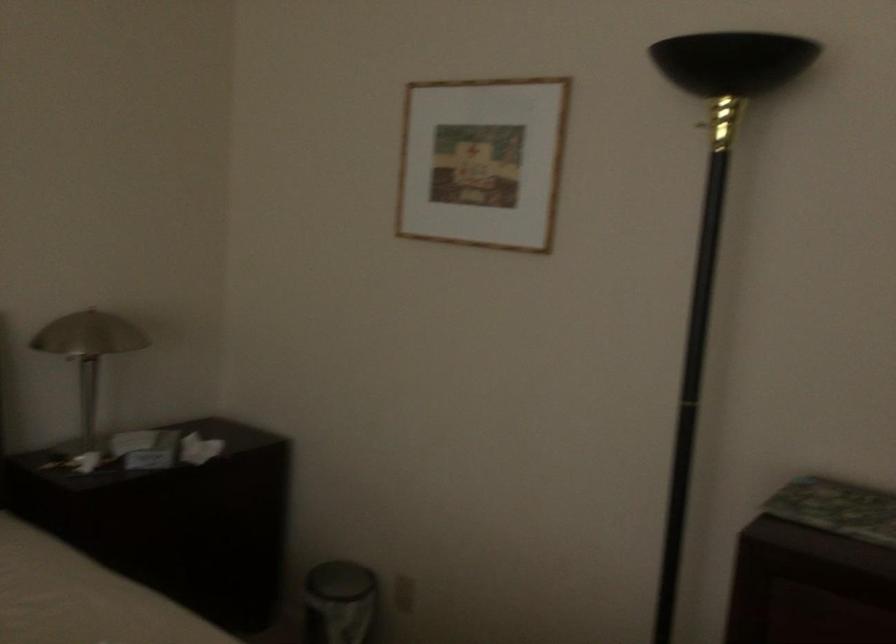
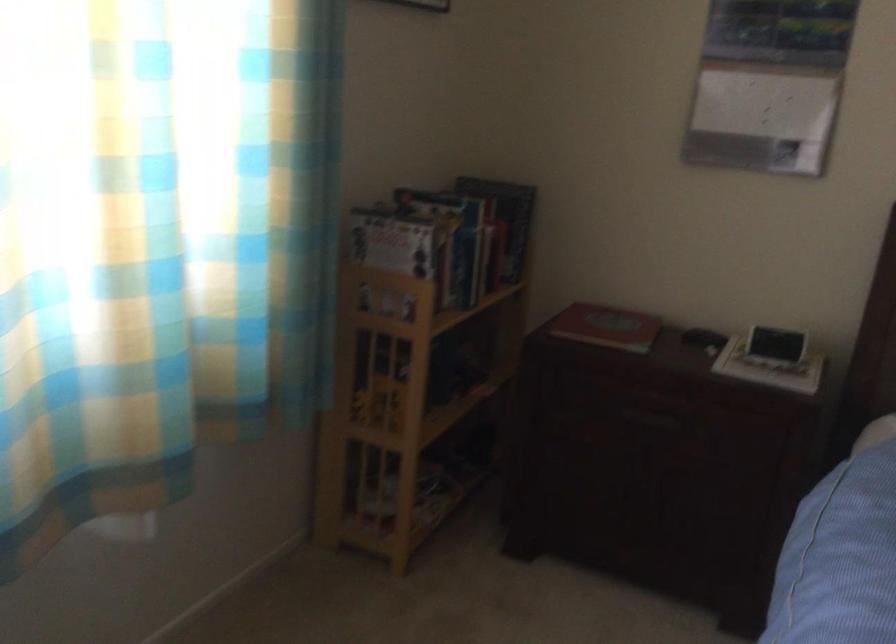
Question: Based on the continuous images, in which direction is the camera rotating? Reply with the corresponding letter.

Choices:
 (A) Left
 (B) Right
 (C) Up
 (D) Down

Answer: (A)